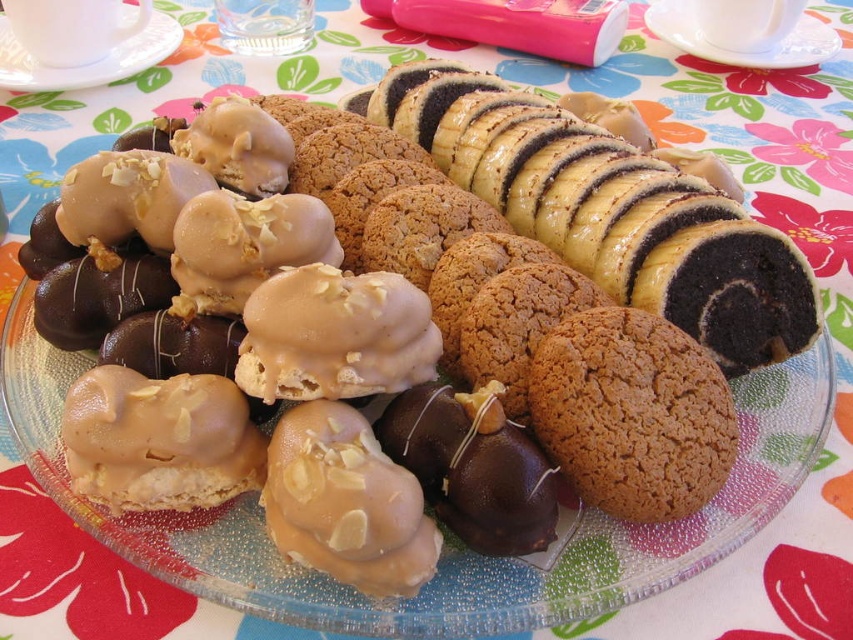
Question: Which object is closer to the camera taking this photo?

Choices:
 (A) matte almond-coated pastry at center-left
 (B) matte caramel almond at center
 (C) brown crumbly cookie at center
 (D) white glossy plate at upper center

Answer: (B)

Question: Which of the following is the closest to the observer?

Choices:
 (A) (30, 61)
 (B) (354, 451)
 (C) (735, 312)

Answer: (B)

Question: Is the position of caramel-coated almond cookies at center less distant than that of white ceramic cup at upper left?

Choices:
 (A) no
 (B) yes

Answer: (B)

Question: Does matte caramel almond at center have a lesser width compared to white glossy plate at upper center?

Choices:
 (A) no
 (B) yes

Answer: (B)

Question: Estimate the real-world distances between objects in this image. Which object is closer to the white ceramic cup at upper left?

Choices:
 (A) white glossy plate at upper center
 (B) brown crumbly cookie at center
 (C) matte caramel cookie at center

Answer: (A)

Question: Can you confirm if brown crumbly cookie at center is thinner than white glossy plate at upper center?

Choices:
 (A) no
 (B) yes

Answer: (B)